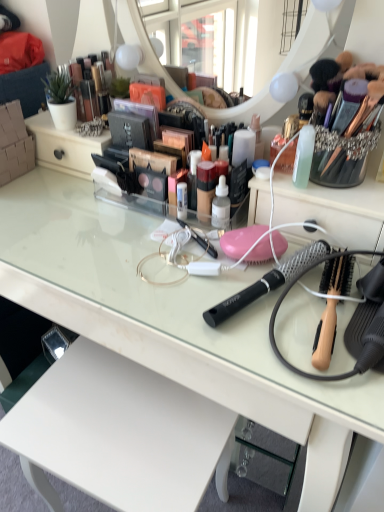
Where is `empty space that is to the right of black mesh hairbrush at center, which appears as the second brush when viewed from the right`? This screenshot has width=384, height=512. empty space that is to the right of black mesh hairbrush at center, which appears as the second brush when viewed from the right is located at coordinates (346, 297).